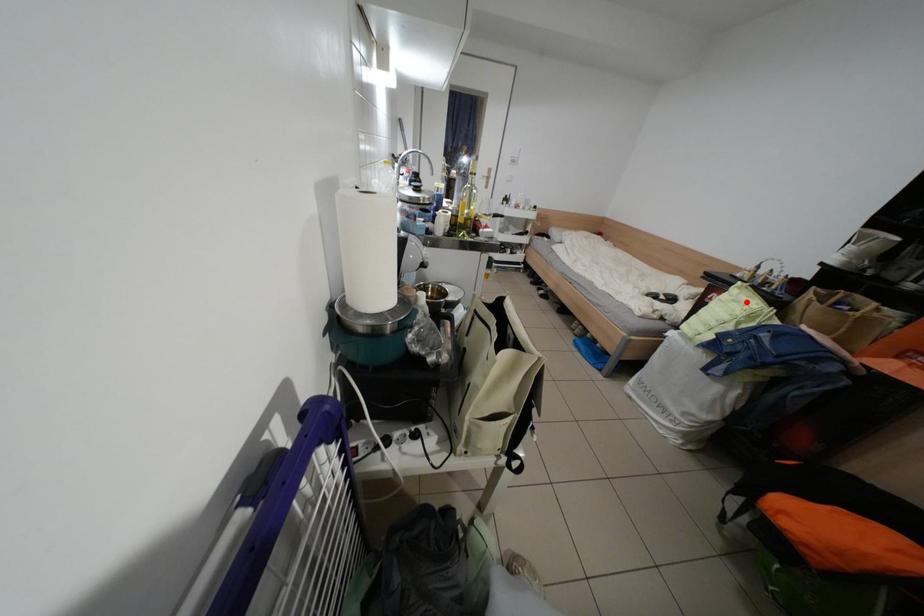
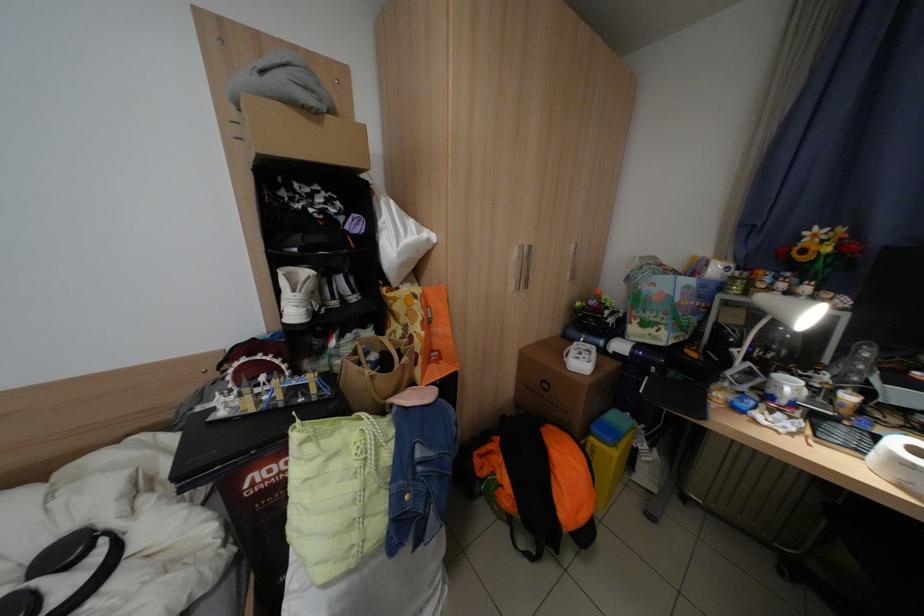
Where in the second image is the point corresponding to the highlighted location from the first image?

(342, 460)